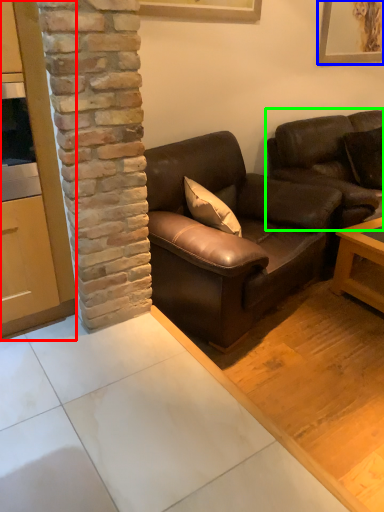
Question: Which object is the closest to the cabinetry (highlighted by a red box)? Choose among these: picture frame (highlighted by a blue box) or studio couch (highlighted by a green box).

Choices:
 (A) picture frame
 (B) studio couch

Answer: (B)